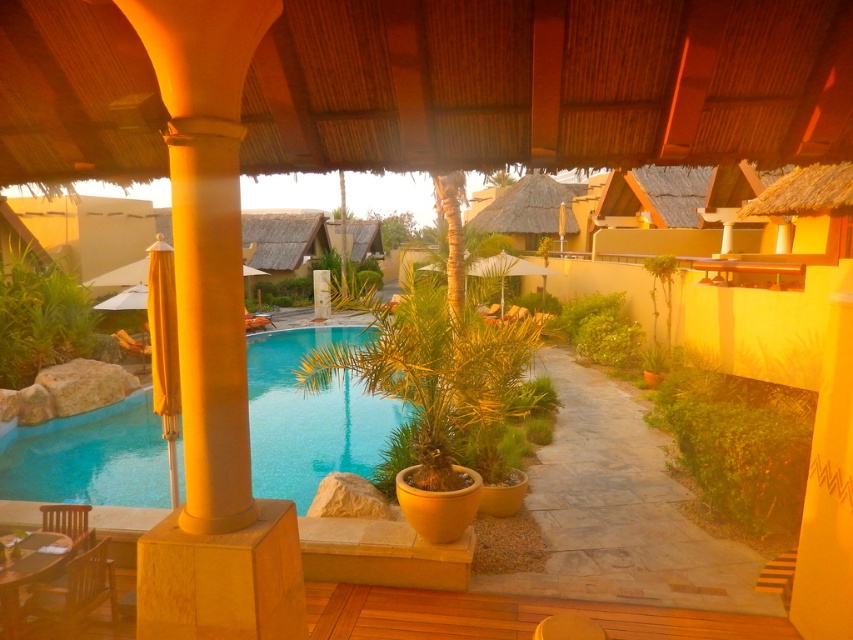
Between matte yellow column at left and wooden chair at lower left, which one has more height?

With more height is matte yellow column at left.

Where is `matte yellow column at left`? This screenshot has width=853, height=640. matte yellow column at left is located at coordinates (212, 346).

Where is `matte yellow column at left`? matte yellow column at left is located at coordinates (212, 346).

From the picture: Does green leafy plant at left come behind wooden lounge chair at lower left?

No.

Is green leafy plant at left wider than wooden lounge chair at lower left?

Indeed, green leafy plant at left has a greater width compared to wooden lounge chair at lower left.

Where is `green leafy plant at left`? The height and width of the screenshot is (640, 853). green leafy plant at left is located at coordinates (39, 317).

Between point (286, 406) and point (26, 618), which one is positioned behind?

Point (286, 406)

Between blue glossy swimming pool at lower left and wooden chair at lower left, which one has more height?

blue glossy swimming pool at lower left

Measure the distance between point [323,340] and camera.

21.24 meters

You are a GUI agent. You are given a task and a screenshot of the screen. Output one action in this format:
    pyautogui.click(x=<x>, y=<y>)
    Task: Click on the blue glossy swimming pool at lower left
    This screenshot has width=853, height=640.
    Given the screenshot: What is the action you would take?
    pyautogui.click(x=309, y=417)